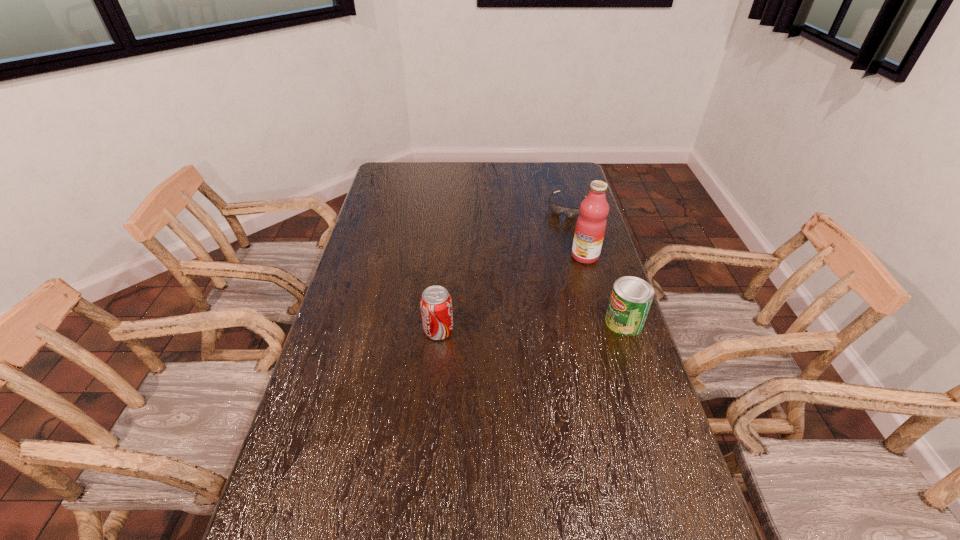
The width and height of the screenshot is (960, 540). Identify the location of free spot located 0.090m on the lenses of the goggles. (556, 231).

The width and height of the screenshot is (960, 540). Find the location of `free location located on the label of the second farthest object`. free location located on the label of the second farthest object is located at coordinates (555, 286).

Where is `vacant space located on the label of the second farthest object`? This screenshot has width=960, height=540. vacant space located on the label of the second farthest object is located at coordinates (541, 299).

This screenshot has width=960, height=540. Find the location of `free region located on the label of the second farthest object`. free region located on the label of the second farthest object is located at coordinates (539, 303).

Where is `can at the right edge`? can at the right edge is located at coordinates (631, 297).

Identify the location of goggles at the right edge. Image resolution: width=960 pixels, height=540 pixels. (570, 212).

In order to click on fruit juice that is at the right edge in this screenshot , I will do `click(590, 228)`.

At what (x,y) coordinates should I click in order to perform the action: click on free space at the far edge. Please return your answer as a coordinate pair (x, y). The image size is (960, 540). Looking at the image, I should click on (525, 178).

The height and width of the screenshot is (540, 960). In order to click on vacant space at the near edge of the desktop in this screenshot , I will do `click(566, 535)`.

You are a GUI agent. You are given a task and a screenshot of the screen. Output one action in this format:
    pyautogui.click(x=<x>, y=<y>)
    Task: Click on the free region at the left edge of the desktop
    This screenshot has height=540, width=960.
    Given the screenshot: What is the action you would take?
    pyautogui.click(x=344, y=390)